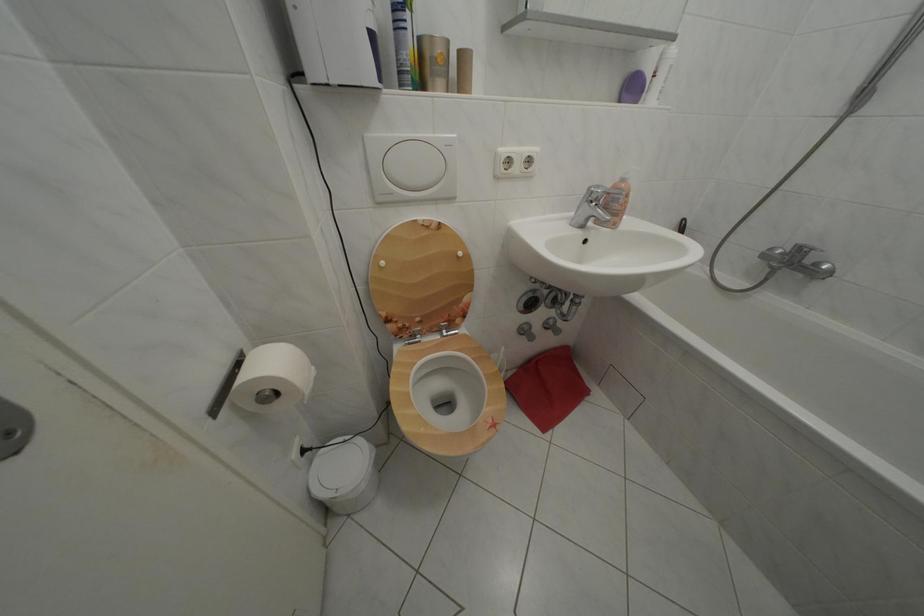
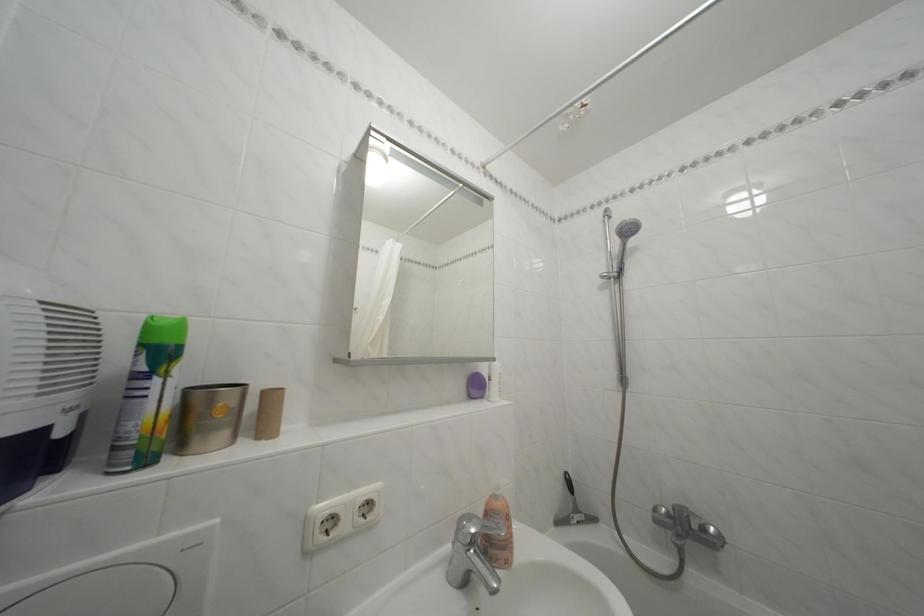
How did the camera likely rotate?

The camera rotated toward right-up.